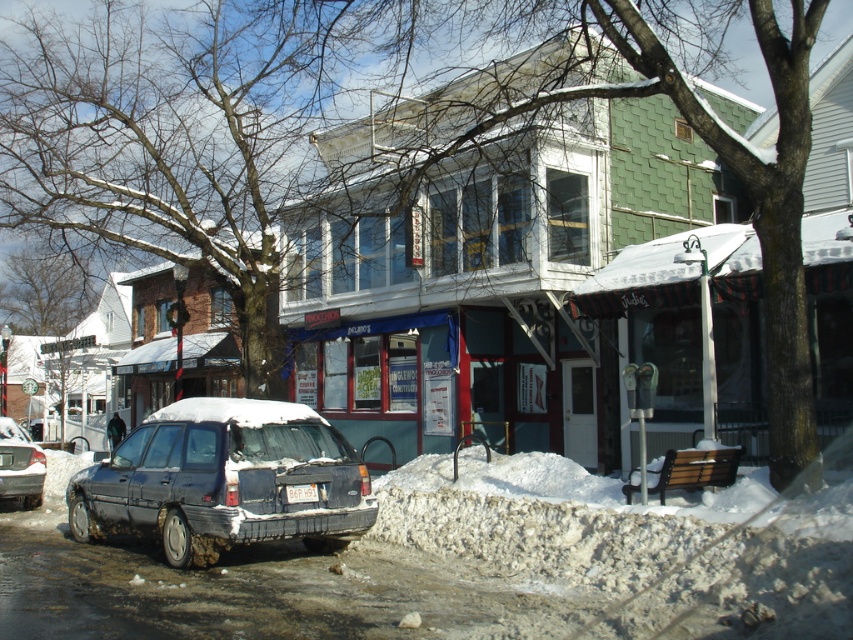
Does dirty metallic car at center have a smaller size compared to blue painted storefront at center?

Actually, dirty metallic car at center might be larger than blue painted storefront at center.

Does dirty metallic car at center have a greater width compared to blue painted storefront at center?

Yes.

Is point (189, 476) positioned behind point (376, 371)?

No, (189, 476) is in front of (376, 371).

At what (x,y) coordinates should I click in order to perform the action: click on dirty metallic car at center. Please return your answer as a coordinate pair (x, y). Looking at the image, I should click on 225,481.

How much distance is there between dirty metallic car at center and matte gray station wagon at lower left?

dirty metallic car at center is 5.58 meters from matte gray station wagon at lower left.

Is point (218, 509) positioned after point (9, 490)?

No, (218, 509) is in front of (9, 490).

Who is more distant from viewer, (67,508) or (20,445)?

Point (20,445)

This screenshot has height=640, width=853. I want to click on dirty metallic car at center, so pyautogui.click(x=225, y=481).

Does point (833, 289) come behind point (9, 484)?

No, it is in front of (9, 484).

Does green shingled building at center have a lesser width compared to matte gray station wagon at lower left?

No, green shingled building at center is not thinner than matte gray station wagon at lower left.

Describe the element at coordinates (691, 332) in the screenshot. The image size is (853, 640). I see `green shingled building at center` at that location.

Identify the location of green shingled building at center. click(x=691, y=332).